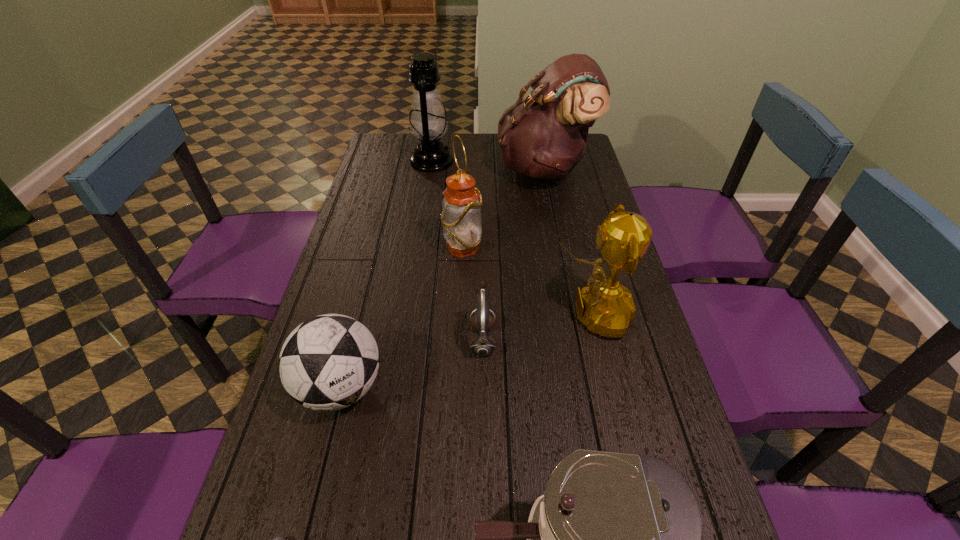
This screenshot has width=960, height=540. In order to click on satchel in this screenshot , I will do `click(544, 136)`.

Find the location of a particular element. the farther oil lamp is located at coordinates (428, 122).

Where is `the third farthest object`? The width and height of the screenshot is (960, 540). the third farthest object is located at coordinates (461, 207).

Image resolution: width=960 pixels, height=540 pixels. What are the coordinates of `award` in the screenshot? It's located at (606, 307).

This screenshot has width=960, height=540. I want to click on soccer ball, so click(329, 362).

Identify the location of earphone. (482, 344).

You are a GUI agent. You are given a task and a screenshot of the screen. Output one action in this format:
    pyautogui.click(x=<x>, y=<y>)
    Task: Click on the vacant space located at the front of the satchel with buckles
    The height and width of the screenshot is (540, 960).
    Given the screenshot: What is the action you would take?
    pyautogui.click(x=427, y=168)

Where is `free spot located 0.150m at the front of the satchel with buckles`? The height and width of the screenshot is (540, 960). free spot located 0.150m at the front of the satchel with buckles is located at coordinates (458, 168).

Where is `free space located at the front of the satchel with buckles`? Image resolution: width=960 pixels, height=540 pixels. free space located at the front of the satchel with buckles is located at coordinates (420, 168).

At what (x,y) coordinates should I click in order to perform the action: click on free spot located on the right of the farther oil lamp. Please return your answer as a coordinate pair (x, y). This screenshot has height=540, width=960. Looking at the image, I should click on (541, 161).